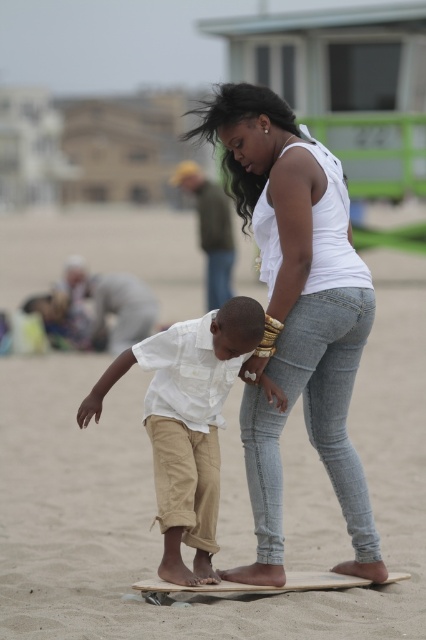
Which is more to the left, smooth wooden surfboard at center or wooden skateboard at center?

smooth wooden surfboard at center

Which is behind, point (414, 444) or point (389, 580)?

Positioned behind is point (414, 444).

Who is more distant from viewer, [134,592] or [175,588]?

Point [134,592]

Image resolution: width=426 pixels, height=640 pixels. I want to click on smooth wooden surfboard at center, so click(154, 497).

Can you confirm if white denim jeans at center is positioned to the right of white cotton shirt at center?

Indeed, white denim jeans at center is positioned on the right side of white cotton shirt at center.

Measure the distance between point (310, 307) and camera.

6.51 meters

Is point (285, 301) closer to viewer compared to point (195, 464)?

Yes, it is in front of point (195, 464).

The height and width of the screenshot is (640, 426). Identify the location of white denim jeans at center. (293, 324).

Does white cotton shirt at center appear on the right side of wooden skateboard at center?

No, white cotton shirt at center is not to the right of wooden skateboard at center.

Is point (169, 340) closer to camera compared to point (135, 582)?

Yes, it is in front of point (135, 582).

Who is more forward, (221, 394) or (285, 580)?

Point (285, 580) is more forward.

The height and width of the screenshot is (640, 426). What are the coordinates of `white cotton shirt at center` in the screenshot? It's located at (186, 480).